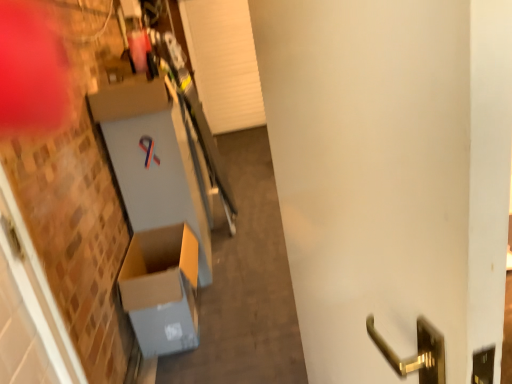
Where is `space that is in front of brown cardboard box at lower left`? This screenshot has height=384, width=512. space that is in front of brown cardboard box at lower left is located at coordinates (198, 365).